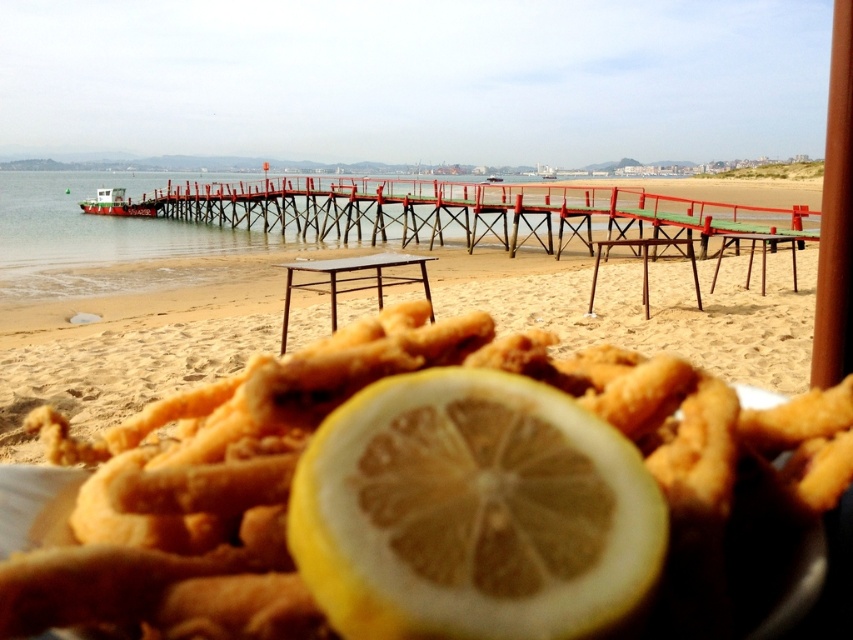
Which is more to the right, golden fried calamari at center or yellow matte lemon at center?

From the viewer's perspective, yellow matte lemon at center appears more on the right side.

Does golden fried calamari at center have a greater width compared to yellow matte lemon at center?

Correct, the width of golden fried calamari at center exceeds that of yellow matte lemon at center.

Where is `golden fried calamari at center`? This screenshot has height=640, width=853. golden fried calamari at center is located at coordinates pos(344,408).

Can you confirm if yellow matte lemon at center is positioned below sandy yellow at lower center?

Yes.

Can you confirm if yellow matte lemon at center is wider than sandy yellow at lower center?

No, yellow matte lemon at center is not wider than sandy yellow at lower center.

Image resolution: width=853 pixels, height=640 pixels. What do you see at coordinates (473, 513) in the screenshot?
I see `yellow matte lemon at center` at bounding box center [473, 513].

Identify the location of yellow matte lemon at center. Image resolution: width=853 pixels, height=640 pixels. (473, 513).

Does golden fried calamari at center have a lesser width compared to sandy yellow at lower center?

Yes.

Does golden fried calamari at center appear on the right side of sandy yellow at lower center?

No, golden fried calamari at center is not to the right of sandy yellow at lower center.

At what (x,y) coordinates should I click in order to perform the action: click on golden fried calamari at center. Please return your answer as a coordinate pair (x, y). The height and width of the screenshot is (640, 853). Looking at the image, I should click on (344, 408).

Image resolution: width=853 pixels, height=640 pixels. In order to click on golden fried calamari at center in this screenshot , I will do `click(344, 408)`.